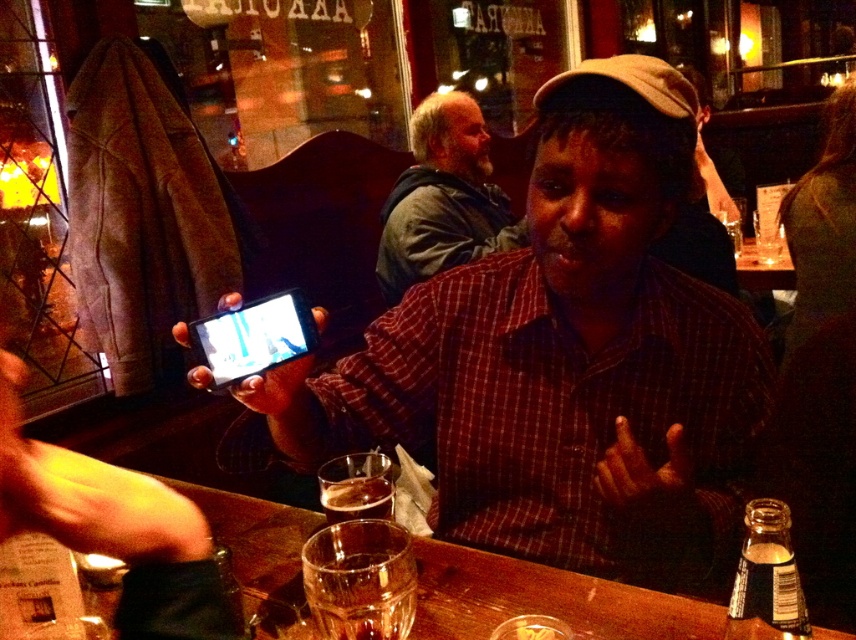
Can you confirm if matte black phone at center is smaller than transparent glass at lower center?

Actually, matte black phone at center might be larger than transparent glass at lower center.

Is point (718, 291) behind point (274, 582)?

That is True.

Measure the distance between matte black phone at center and camera.

matte black phone at center is 70.19 centimeters away from camera.

Locate an element on the screen. The height and width of the screenshot is (640, 856). matte black phone at center is located at coordinates [x=562, y=358].

Is point (464, 625) less distant than point (447, 216)?

Yes, it is.

Is transparent glass at lower center below bearded man at center?

Yes, transparent glass at lower center is below bearded man at center.

Locate an element on the screen. The width and height of the screenshot is (856, 640). transparent glass at lower center is located at coordinates (544, 600).

This screenshot has height=640, width=856. I want to click on transparent glass at lower center, so click(x=544, y=600).

Is matte black phone at center below bearded man at center?

Yes, matte black phone at center is below bearded man at center.

Is matte black phone at center bigger than bearded man at center?

Yes, matte black phone at center is bigger than bearded man at center.

Is point (563, 348) positioned in front of point (458, 209)?

Yes.

This screenshot has height=640, width=856. What are the coordinates of `matte black phone at center` in the screenshot? It's located at (562, 358).